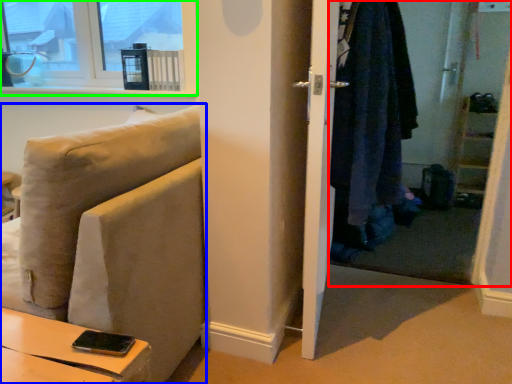
Question: Which object is positioned farthest from closet (highlighted by a red box)? Select from studio couch (highlighted by a blue box) and window (highlighted by a green box).

Choices:
 (A) studio couch
 (B) window

Answer: (B)